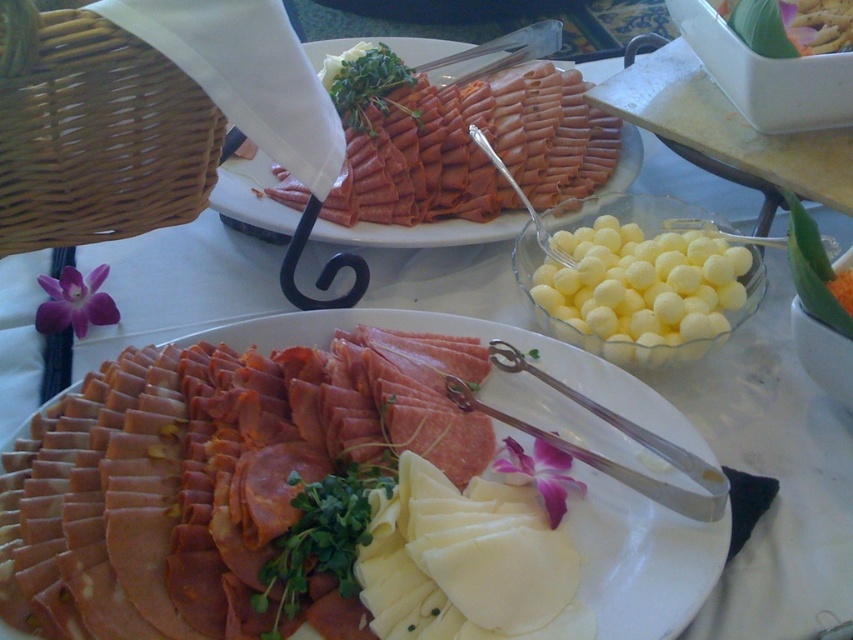
What do you see at coordinates (639, 288) in the screenshot? The image size is (853, 640). I see `yellow matte cheese balls at center` at bounding box center [639, 288].

Which is behind, point (531, 257) or point (838, 323)?

Positioned behind is point (531, 257).

Identify the location of yellow matte cheese balls at center. The image size is (853, 640). (639, 288).

Does sliced meat at center lie behind green leafy vegetable at upper right?

No.

Does sliced meat at center have a lesser height compared to green leafy vegetable at upper right?

No, sliced meat at center is not shorter than green leafy vegetable at upper right.

The height and width of the screenshot is (640, 853). What do you see at coordinates (641, 560) in the screenshot? I see `sliced meat at center` at bounding box center [641, 560].

The image size is (853, 640). Identify the location of sliced meat at center. (641, 560).

Is point (368, 321) closer to viewer compared to point (326, 237)?

Yes.

Is point (289, 321) more distant than point (335, 236)?

No, it is not.

This screenshot has width=853, height=640. I want to click on sliced meat at center, so [x=641, y=560].